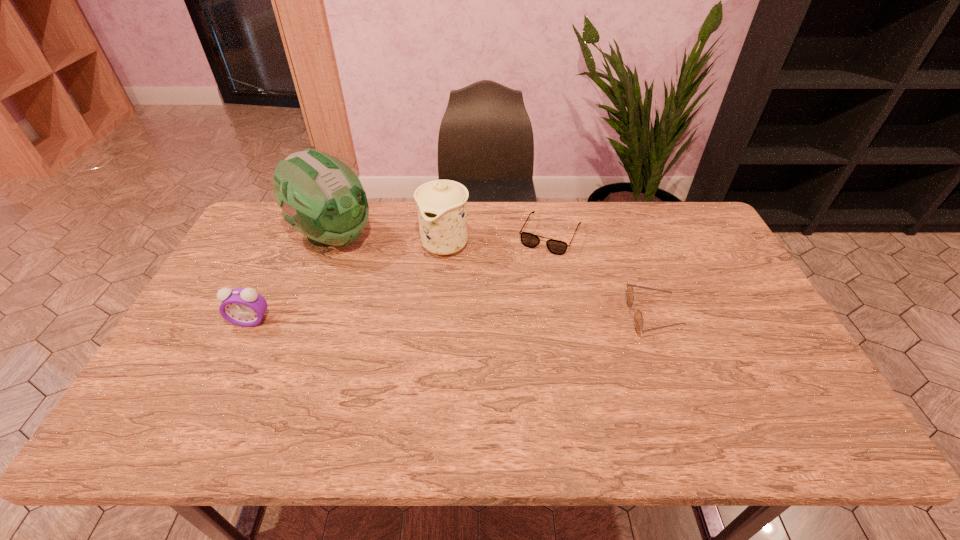
Where is `object identified as the third closest to the third tallest object`? object identified as the third closest to the third tallest object is located at coordinates (557, 247).

In order to click on vacant region that satisfies the following two spatial constraints: 1. on the front side of the rightmost object; 2. on the front-facing side of the second object from right to left in this screenshot , I will do `click(565, 316)`.

Locate an element on the screen. vacant space that satisfies the following two spatial constraints: 1. on the front side of the right spectacles; 2. on the front-facing side of the fourth shortest object is located at coordinates (439, 316).

Find the location of a particular element. This screenshot has width=960, height=540. free location that satisfies the following two spatial constraints: 1. on the back side of the left spectacles; 2. on the right side of the football helmet is located at coordinates (333, 234).

Where is `free space in the image that satisfies the following two spatial constraints: 1. on the front side of the rightmost object; 2. on the front-facing side of the third object from left to right`? The image size is (960, 540). free space in the image that satisfies the following two spatial constraints: 1. on the front side of the rightmost object; 2. on the front-facing side of the third object from left to right is located at coordinates (439, 316).